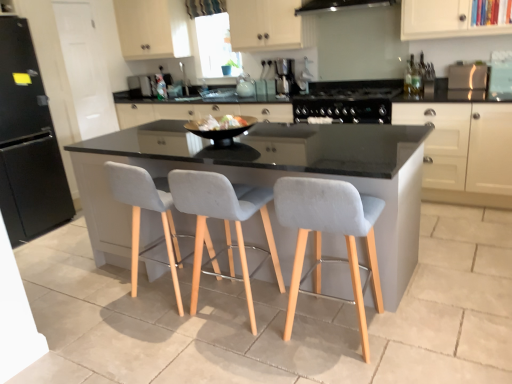
Question: Are black glass range hood at upper center and transparent glass window at upper center far apart?

Choices:
 (A) no
 (B) yes

Answer: (B)

Question: Is black glass range hood at upper center touching transparent glass window at upper center?

Choices:
 (A) yes
 (B) no

Answer: (B)

Question: Is black glass range hood at upper center surrounding transparent glass window at upper center?

Choices:
 (A) no
 (B) yes

Answer: (A)

Question: Is black glass range hood at upper center taller than transparent glass window at upper center?

Choices:
 (A) no
 (B) yes

Answer: (A)

Question: From the image's perspective, is black glass range hood at upper center under transparent glass window at upper center?

Choices:
 (A) yes
 (B) no

Answer: (A)

Question: From the image's perspective, is black glass range hood at upper center over transparent glass window at upper center?

Choices:
 (A) no
 (B) yes

Answer: (A)

Question: Is gray granite countertop at center at the right side of light gray fabric chair at center, which appears as the third chair when viewed from the left?

Choices:
 (A) no
 (B) yes

Answer: (A)

Question: Is gray granite countertop at center not inside light gray fabric chair at center, which is counted as the first chair, starting from the right?

Choices:
 (A) yes
 (B) no

Answer: (A)

Question: Can you confirm if gray granite countertop at center is thinner than light gray fabric chair at center, which appears as the third chair when viewed from the left?

Choices:
 (A) no
 (B) yes

Answer: (B)

Question: Considering the relative sizes of gray granite countertop at center and light gray fabric chair at center, which is counted as the first chair, starting from the right, in the image provided, is gray granite countertop at center shorter than light gray fabric chair at center, which is counted as the first chair, starting from the right,?

Choices:
 (A) yes
 (B) no

Answer: (A)

Question: Are gray granite countertop at center and light gray fabric chair at center, which is counted as the first chair, starting from the right, beside each other?

Choices:
 (A) no
 (B) yes

Answer: (A)

Question: Is the position of gray granite countertop at center less distant than that of light gray fabric chair at center, which is counted as the first chair, starting from the right?

Choices:
 (A) yes
 (B) no

Answer: (A)

Question: Is black glass range hood at upper center shorter than light gray fabric chair at center, which appears as the 1th chair when viewed from the left?

Choices:
 (A) no
 (B) yes

Answer: (B)